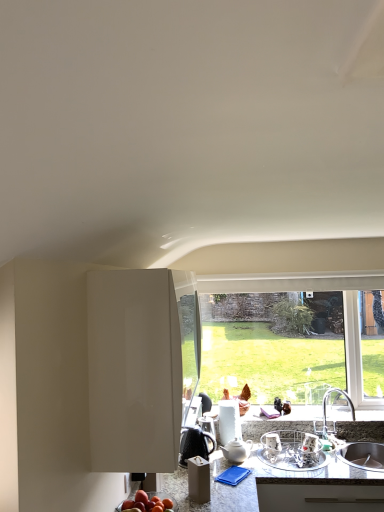
Question: Is metallic silver dish rack at center, the 1th appliance viewed from the right, inside the boundaries of white glossy cabinet at center, or outside?

Choices:
 (A) inside
 (B) outside

Answer: (B)

Question: Looking at their shapes, would you say metallic silver dish rack at center, arranged as the 2th appliance when viewed from the left, is wider or thinner than white glossy cabinet at center?

Choices:
 (A) thin
 (B) wide

Answer: (B)

Question: Which object is positioned farthest from the white glossy teapot at center?

Choices:
 (A) black glossy coffee pot at center, which ranks as the 1th appliance in left-to-right order
 (B) metallic silver dish rack at center, arranged as the 2th appliance when viewed from the left
 (C) transparent glass window at center
 (D) white glossy cabinet at center
 (E) white ceramic sink at lower right

Answer: (D)

Question: Estimate the real-world distances between objects in this image. Which object is farther from the transparent glass window at center?

Choices:
 (A) shiny red apple at lower center
 (B) metallic silver dish rack at center, arranged as the 2th appliance when viewed from the left
 (C) black glossy coffee pot at center, acting as the second appliance starting from the right
 (D) granite gray countertop at lower center
 (E) white glossy teapot at center

Answer: (A)